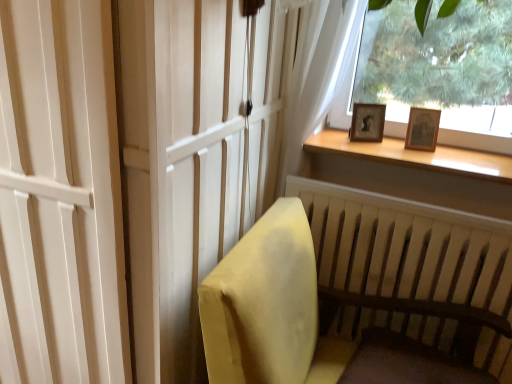
Question: Should I look upward or downward to see wooden photo frame at upper right?

Choices:
 (A) down
 (B) up

Answer: (B)

Question: From a real-world perspective, is velvet yellow chair at lower right positioned under wooden frame at upper right based on gravity?

Choices:
 (A) no
 (B) yes

Answer: (B)

Question: Can you confirm if velvet yellow chair at lower right is wider than wooden frame at upper right?

Choices:
 (A) no
 (B) yes

Answer: (B)

Question: Is velvet yellow chair at lower right completely or partially outside of wooden frame at upper right?

Choices:
 (A) no
 (B) yes

Answer: (B)

Question: Is velvet yellow chair at lower right positioned in front of wooden frame at upper right?

Choices:
 (A) yes
 (B) no

Answer: (A)

Question: Considering the relative positions of velvet yellow chair at lower right and wooden frame at upper right in the image provided, is velvet yellow chair at lower right to the left of wooden frame at upper right from the viewer's perspective?

Choices:
 (A) yes
 (B) no

Answer: (A)

Question: Does velvet yellow chair at lower right have a lesser height compared to wooden frame at upper right?

Choices:
 (A) no
 (B) yes

Answer: (A)

Question: Does wooden at upper right have a greater height compared to velvet yellow chair at lower right?

Choices:
 (A) yes
 (B) no

Answer: (B)

Question: From a real-world perspective, is wooden at upper right on velvet yellow chair at lower right?

Choices:
 (A) yes
 (B) no

Answer: (A)

Question: From the image's perspective, is wooden at upper right beneath velvet yellow chair at lower right?

Choices:
 (A) yes
 (B) no

Answer: (B)

Question: Is wooden at upper right in front of velvet yellow chair at lower right?

Choices:
 (A) yes
 (B) no

Answer: (B)

Question: Is wooden at upper right positioned far away from velvet yellow chair at lower right?

Choices:
 (A) no
 (B) yes

Answer: (A)

Question: Would you say wooden at upper right is outside velvet yellow chair at lower right?

Choices:
 (A) yes
 (B) no

Answer: (A)

Question: Does dark wood footrest at lower right have a lesser width compared to wooden frame at upper right?

Choices:
 (A) yes
 (B) no

Answer: (B)